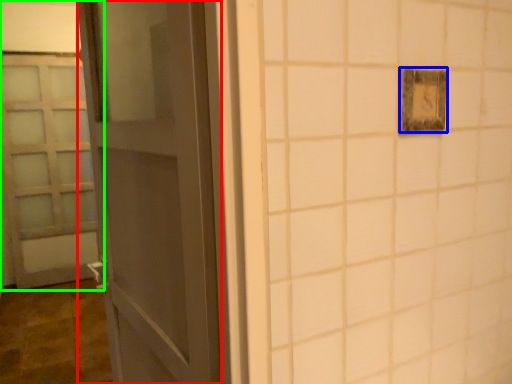
Question: Based on their relative distances, which object is farther from door (highlighted by a red box)? Choose from light switch (highlighted by a blue box) and door (highlighted by a green box).

Choices:
 (A) light switch
 (B) door

Answer: (B)